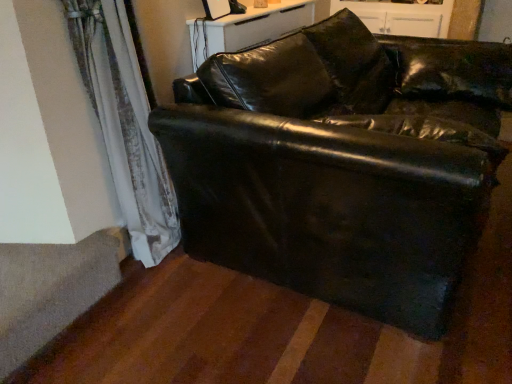
Question: Considering the relative sizes of satin white curtain at lower left and black leather couch at center in the image provided, is satin white curtain at lower left shorter than black leather couch at center?

Choices:
 (A) yes
 (B) no

Answer: (B)

Question: Is satin white curtain at lower left taller than black leather couch at center?

Choices:
 (A) no
 (B) yes

Answer: (B)

Question: Can we say satin white curtain at lower left lies outside black leather couch at center?

Choices:
 (A) yes
 (B) no

Answer: (A)

Question: Is satin white curtain at lower left closer to the viewer compared to black leather couch at center?

Choices:
 (A) no
 (B) yes

Answer: (A)

Question: Are satin white curtain at lower left and black leather couch at center beside each other?

Choices:
 (A) yes
 (B) no

Answer: (B)

Question: Considering the relative sizes of satin white curtain at lower left and black leather couch at center in the image provided, is satin white curtain at lower left smaller than black leather couch at center?

Choices:
 (A) no
 (B) yes

Answer: (B)

Question: Is the depth of gray carpet at lower left greater than that of satin white curtain at lower left?

Choices:
 (A) yes
 (B) no

Answer: (A)

Question: From a real-world perspective, is gray carpet at lower left physically above satin white curtain at lower left?

Choices:
 (A) yes
 (B) no

Answer: (B)

Question: Is gray carpet at lower left in contact with satin white curtain at lower left?

Choices:
 (A) no
 (B) yes

Answer: (A)

Question: Is gray carpet at lower left not within satin white curtain at lower left?

Choices:
 (A) no
 (B) yes

Answer: (B)

Question: Considering the relative sizes of gray carpet at lower left and satin white curtain at lower left in the image provided, is gray carpet at lower left taller than satin white curtain at lower left?

Choices:
 (A) no
 (B) yes

Answer: (A)

Question: Does gray carpet at lower left turn towards satin white curtain at lower left?

Choices:
 (A) yes
 (B) no

Answer: (B)

Question: From the image's perspective, is black leather couch at center located above white glossy dresser at upper center?

Choices:
 (A) no
 (B) yes

Answer: (A)